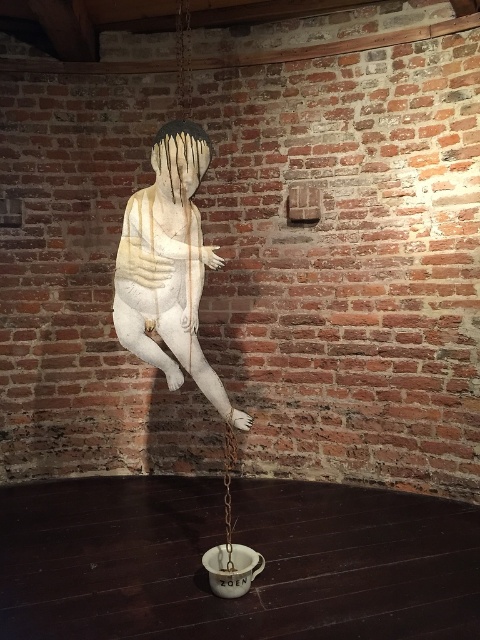
You are an art curator planning to install a spotlight on the white matte sculpture at center. Given the coordinates provided, can you confirm the exact position of the sculpture to ensure proper lighting?

The white matte sculpture at center is located at point coordinates, so the spotlight should be directed to that exact position for optimal illumination.

You are an art curator planning to install a new light fixture between the white matte sculpture at center and the white matte swing at center. The light fixture requires 1.5 meters of space to be safely installed. Based on the scene, can the light fixture be placed between them?

The white matte sculpture at center and the white matte swing at center are 1.32 meters apart from each other. Since the required space for the light fixture is 1.5 meters, which is larger than the available distance, the light fixture cannot be safely installed between them.

You are an art curator planning to install a new spotlight on the white matte sculpture at center and the white matte swing at center. Since both are at the center, which object will the light hit first when directed straight ahead?

The white matte sculpture at center is in front of the white matte swing at center, so the light will hit the white matte sculpture at center first.